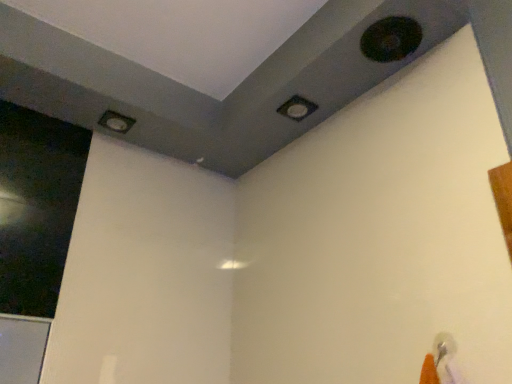
Question: Considering the positions of point (309, 104) and point (414, 26), is point (309, 104) closer or farther from the camera than point (414, 26)?

Choices:
 (A) farther
 (B) closer

Answer: (A)

Question: From a real-world perspective, is matte black square at upper center, which is the 2th hole from top to bottom, physically located above or below black matte hole at upper right, which is the first hole in top-to-bottom order?

Choices:
 (A) below
 (B) above

Answer: (B)

Question: Which object is the farthest from the black matte hole at upper right, which is the first hole in top-to-bottom order?

Choices:
 (A) matte gray hole at upper left, placed as the first hole when sorted from left to right
 (B) matte black square at upper center, which is the 2th hole in front-to-back order
 (C) transparent glass screen door at left

Answer: (C)

Question: Which of these objects is positioned farthest from the black matte hole at upper right, marked as the first hole in a right-to-left arrangement?

Choices:
 (A) matte gray hole at upper left, the third hole in the top-to-bottom sequence
 (B) matte black square at upper center, the second hole in the right-to-left sequence
 (C) transparent glass screen door at left

Answer: (C)